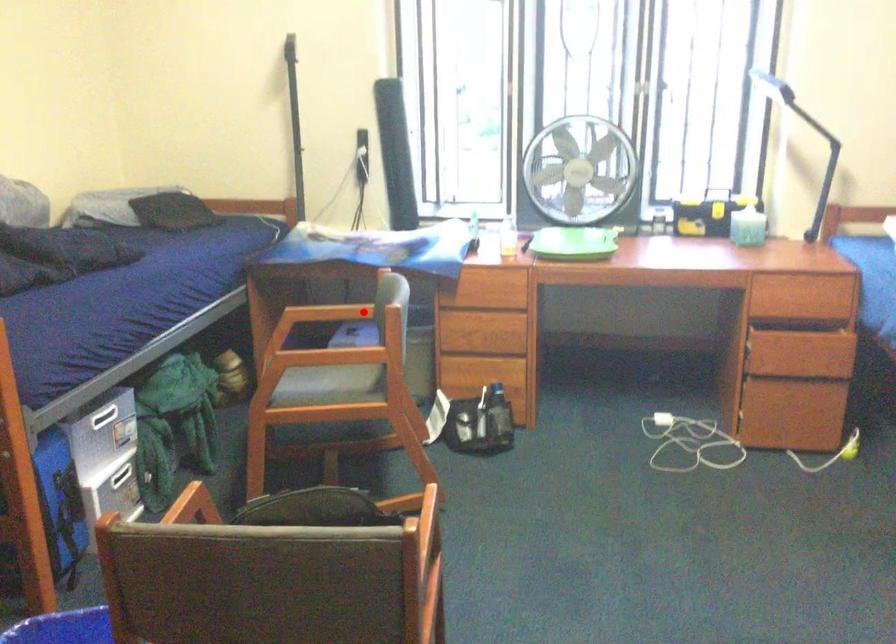
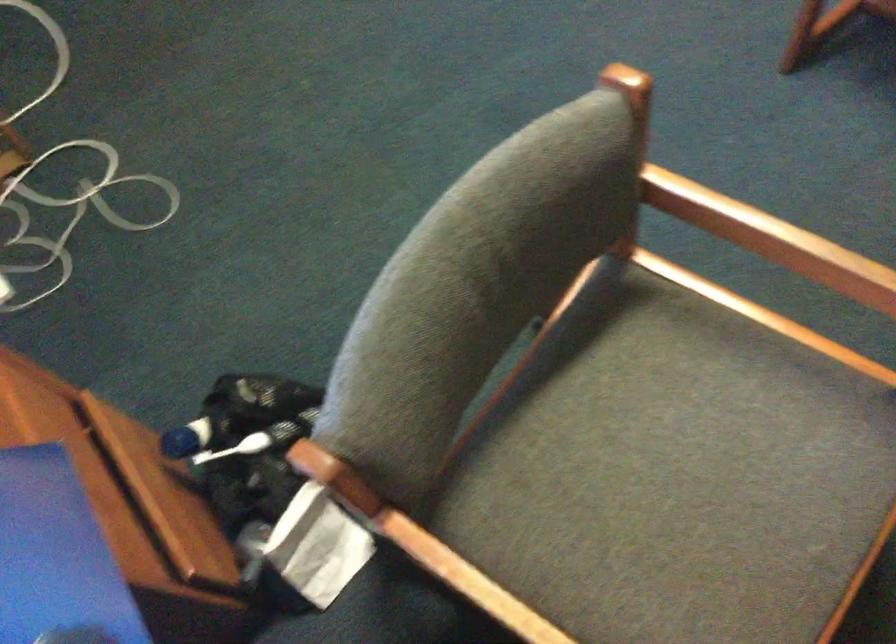
In the second image, find the point that corresponds to the highlighted location in the first image.

(433, 576)